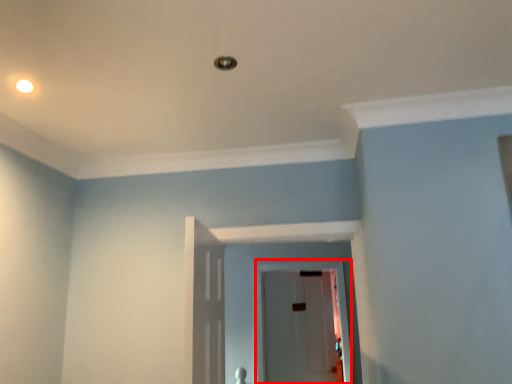
Question: From the image's perspective, what is the correct spatial positioning of glass door (annotated by the red box) in reference to lighting?

Choices:
 (A) above
 (B) below

Answer: (B)